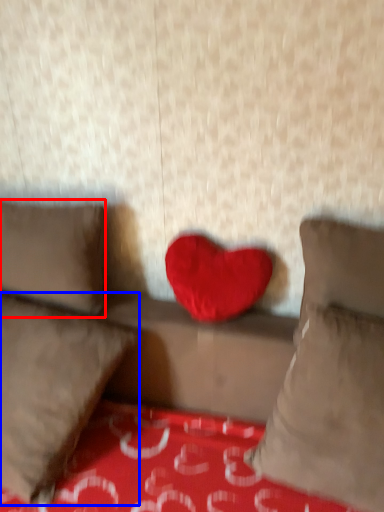
Question: Which point is further to the camera, pillow (highlighted by a red box) or pillow (highlighted by a blue box)?

Choices:
 (A) pillow
 (B) pillow

Answer: (A)